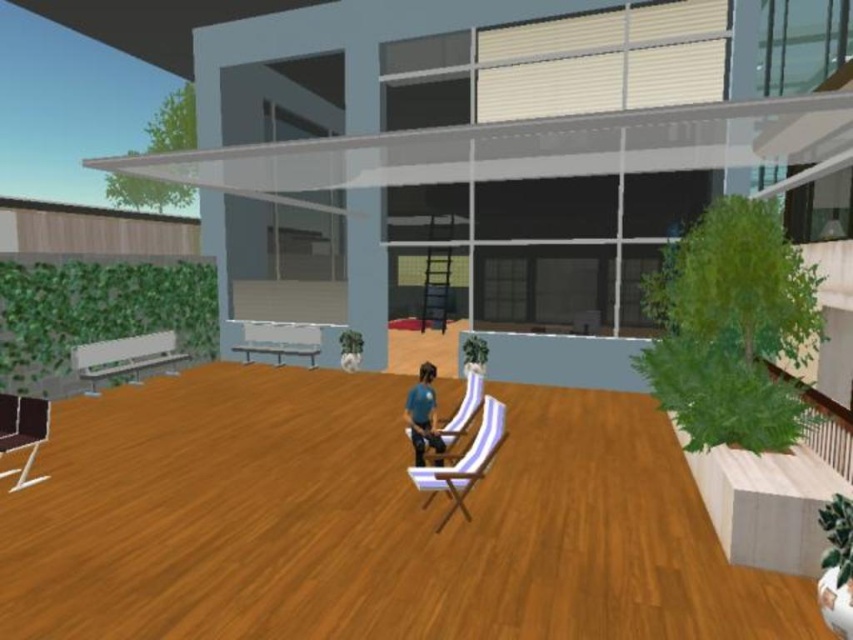
Does striped fabric chair at center appear over dark brown leather armchair at lower left?

Incorrect, striped fabric chair at center is not positioned above dark brown leather armchair at lower left.

Is striped fabric chair at center thinner than dark brown leather armchair at lower left?

Yes, striped fabric chair at center is thinner than dark brown leather armchair at lower left.

Identify the location of striped fabric chair at center. Image resolution: width=853 pixels, height=640 pixels. (463, 461).

This screenshot has height=640, width=853. Find the location of `striped fabric chair at center`. striped fabric chair at center is located at coordinates (463, 461).

Between dark brown leather armchair at lower left and blue fabric chair at center, which one appears on the left side from the viewer's perspective?

dark brown leather armchair at lower left is more to the left.

Does point (9, 403) come in front of point (432, 408)?

Yes, point (9, 403) is closer to viewer.

Who is more distant from viewer, (x=9, y=397) or (x=424, y=392)?

Positioned behind is point (x=424, y=392).

This screenshot has height=640, width=853. I want to click on dark brown leather armchair at lower left, so click(22, 428).

Between striped fabric chair at center and blue fabric chair at center, which one has less height?

blue fabric chair at center

The height and width of the screenshot is (640, 853). Find the location of `striped fabric chair at center`. striped fabric chair at center is located at coordinates (463, 461).

Which is in front, point (474, 456) or point (426, 368)?

Point (474, 456)

In order to click on striped fabric chair at center in this screenshot , I will do `click(463, 461)`.